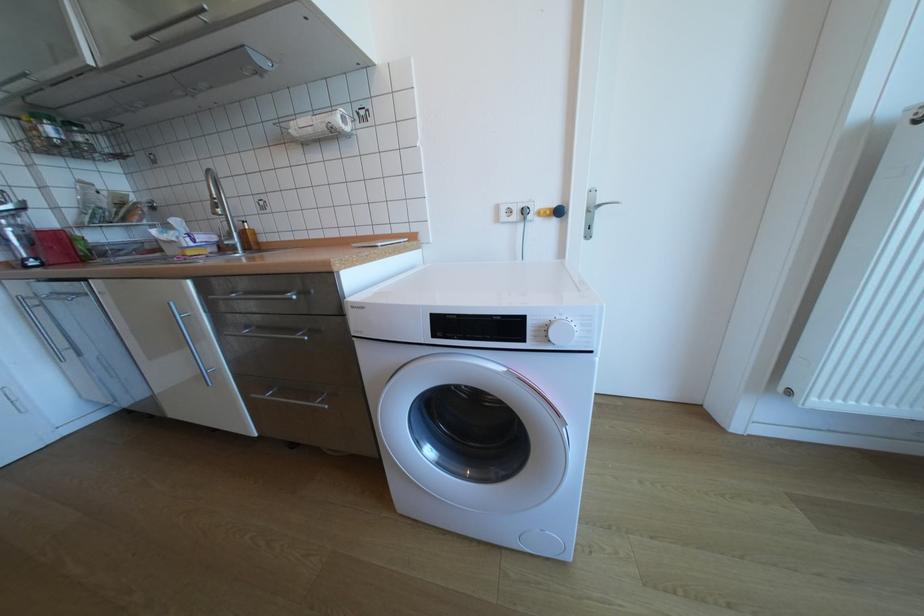
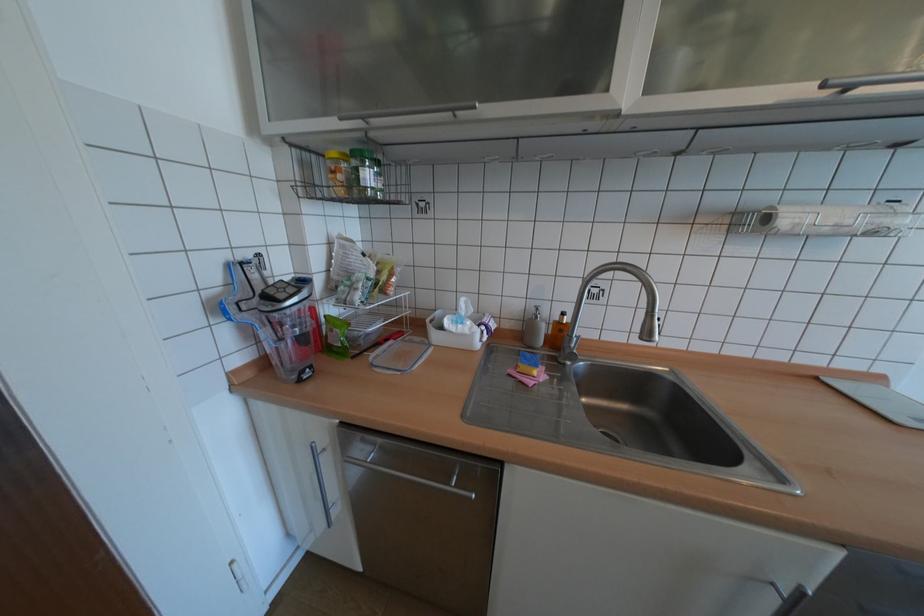
The point at (45, 132) is marked in the first image. Where is the corresponding point in the second image?

(348, 177)